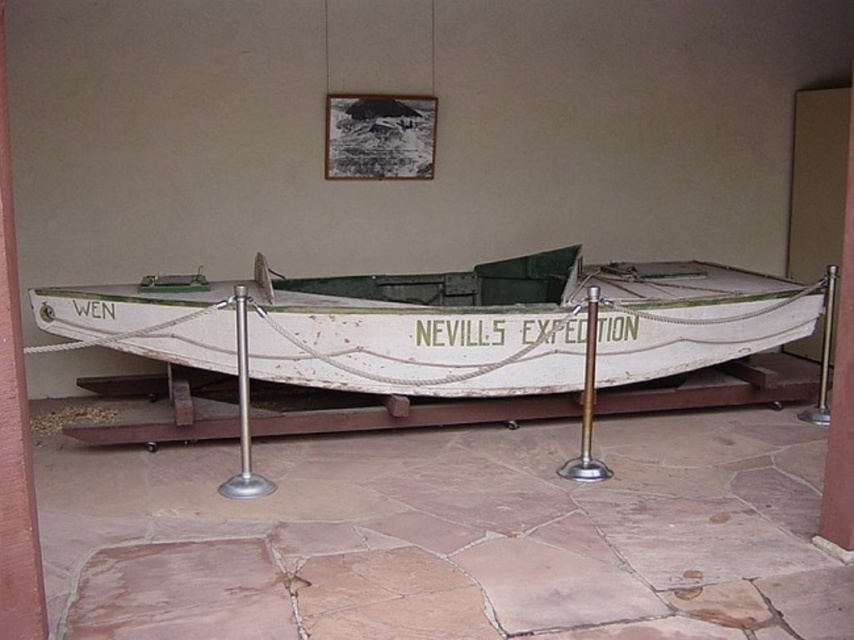
Question: Is white wooden boat at center above silver metallic pole at center?

Choices:
 (A) no
 (B) yes

Answer: (B)

Question: Which of the following is the farthest from the observer?

Choices:
 (A) (238, 372)
 (B) (665, 289)

Answer: (B)

Question: Which object appears closest to the camera in this image?

Choices:
 (A) silver metallic pole at center
 (B) white wooden boat at center

Answer: (A)

Question: Does white wooden boat at center have a lesser width compared to silver metallic pole at center?

Choices:
 (A) no
 (B) yes

Answer: (A)

Question: Which point appears farthest from the camera in this image?

Choices:
 (A) (148, 316)
 (B) (246, 296)

Answer: (A)

Question: Is white wooden boat at center to the right of silver metallic pole at center from the viewer's perspective?

Choices:
 (A) yes
 (B) no

Answer: (A)